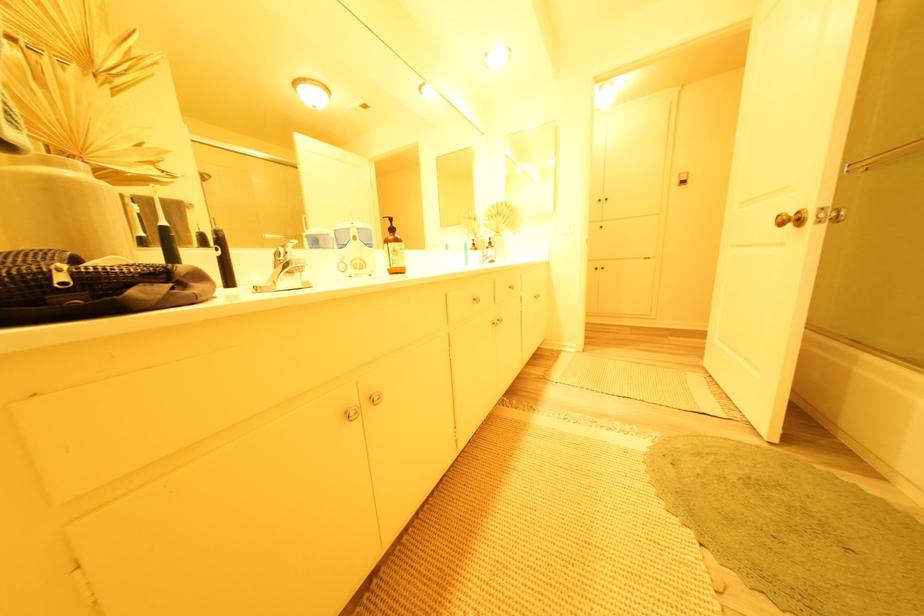
This screenshot has width=924, height=616. I want to click on black pump dispenser, so click(x=224, y=257).